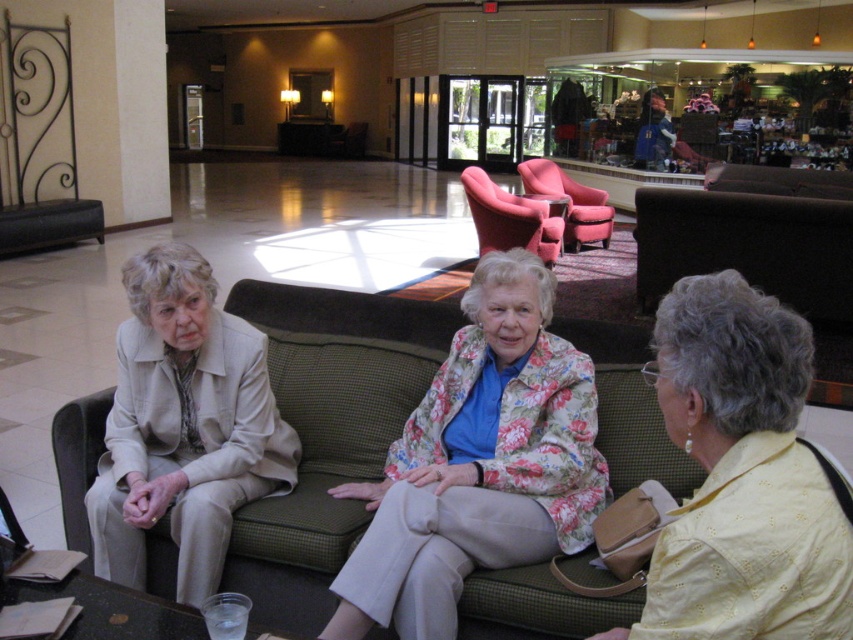
Who is more forward, (527, 557) or (769, 451)?

Point (769, 451) is in front.

This screenshot has height=640, width=853. In order to click on floral fabric jacket at center in this screenshot , I will do `click(479, 461)`.

Can you confirm if green fabric couch at center is positioned below floral fabric jacket at center?

Incorrect, green fabric couch at center is not positioned below floral fabric jacket at center.

Who is more forward, (366,378) or (465,458)?

Point (465,458)

Identify the location of green fabric couch at center. Image resolution: width=853 pixels, height=640 pixels. (328, 432).

Where is `green fabric couch at center`? This screenshot has height=640, width=853. green fabric couch at center is located at coordinates (328, 432).

In the scene shown: Who is shorter, beige fabric jacket at left or matte pink armchair at center?

beige fabric jacket at left is shorter.

Image resolution: width=853 pixels, height=640 pixels. Find the location of `beige fabric jacket at left`. beige fabric jacket at left is located at coordinates (183, 426).

Is point (184, 436) less distant than point (541, 180)?

Yes, it is in front of point (541, 180).

You are a GUI agent. You are given a task and a screenshot of the screen. Output one action in this format:
    pyautogui.click(x=<x>, y=<y>)
    Task: Click on the beige fabric jacket at left
    This screenshot has height=640, width=853.
    Given the screenshot: What is the action you would take?
    pyautogui.click(x=183, y=426)